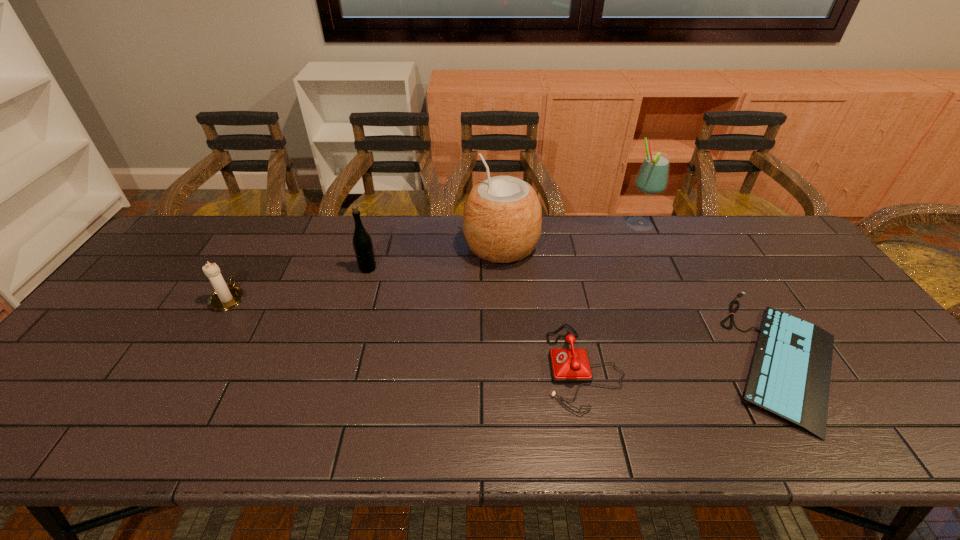
At what (x,y) coordinates should I click in order to perform the action: click on unoccupied area between the computer keyboard and the coconut. Please return your answer as a coordinate pair (x, y). This screenshot has height=540, width=960. Looking at the image, I should click on (x=642, y=301).

The image size is (960, 540). In order to click on free space between the second shortest object and the shortest object in this screenshot , I will do `click(684, 361)`.

The image size is (960, 540). Find the location of `vacant space in between the computer keyboard and the fourth tallest object`. vacant space in between the computer keyboard and the fourth tallest object is located at coordinates (506, 327).

Find the location of a particular element. The height and width of the screenshot is (540, 960). free area in between the coconut and the alcohol is located at coordinates (x=570, y=236).

The image size is (960, 540). Identify the location of blank region between the telephone and the candle holder. (406, 333).

You are a GUI agent. You are given a task and a screenshot of the screen. Output one action in this format:
    pyautogui.click(x=<x>, y=<y>)
    Task: Click on the free spot between the shortest object and the third tallest object
    This screenshot has height=540, width=960.
    Given the screenshot: What is the action you would take?
    pyautogui.click(x=575, y=312)

Where is `empty space between the coconut and the alcohol`? This screenshot has width=960, height=540. empty space between the coconut and the alcohol is located at coordinates (570, 236).

Locate which object ranks fourth in proximity to the fifth tallest object. Please provide its 2D coordinates. Your answer should be formatted as a tuple, i.e. [(x, y)], where the tuple contains the x and y coordinates of a point satisfying the conditions above.

[(362, 243)]

Identify which object is the second nearest to the alcohol. Please provide its 2D coordinates. Your answer should be formatted as a tuple, i.e. [(x, y)], where the tuple contains the x and y coordinates of a point satisfying the conditions above.

[(502, 217)]